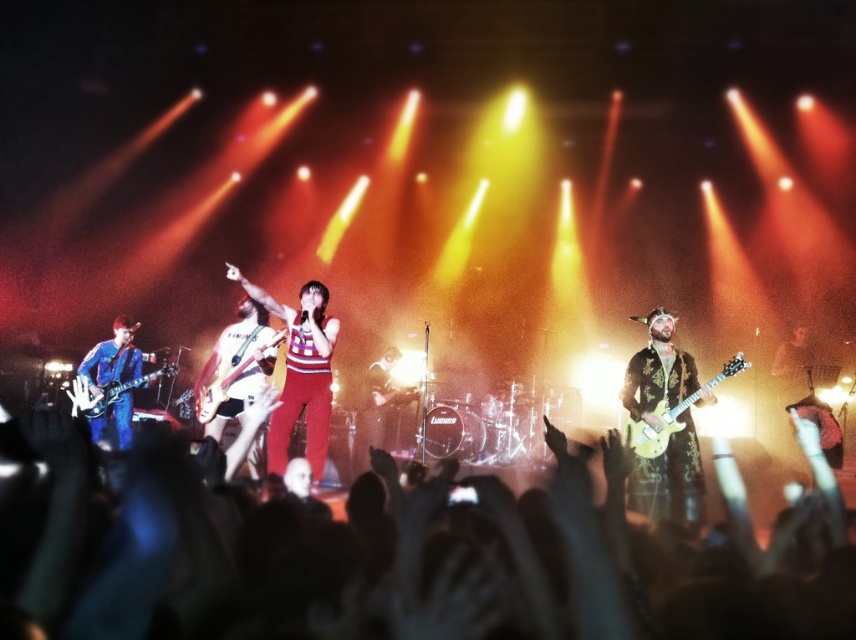
Question: Among these objects, which one is farthest from the camera?

Choices:
 (A) silky black hair at center
 (B) blue denim jacket at left
 (C) shiny red pants at center

Answer: (B)

Question: Can you confirm if shiny gold electric guitar at right is wider than shiny silver guitar at center?

Choices:
 (A) yes
 (B) no

Answer: (B)

Question: Does shiny red pants at center lie behind shiny silver guitar at center?

Choices:
 (A) no
 (B) yes

Answer: (A)

Question: Which point appears closest to the camera in this image?

Choices:
 (A) (311, 344)
 (B) (125, 433)
 (C) (693, 502)

Answer: (C)

Question: Which of the following is the farthest from the observer?

Choices:
 (A) gold textured jacket at center
 (B) shiny gold electric guitar at right
 (C) blue denim jacket at left
 (D) silky black hair at center

Answer: (C)

Question: Considering the relative positions of shiny red pants at center and blue denim jacket at left in the image provided, where is shiny red pants at center located with respect to blue denim jacket at left?

Choices:
 (A) below
 (B) above

Answer: (B)